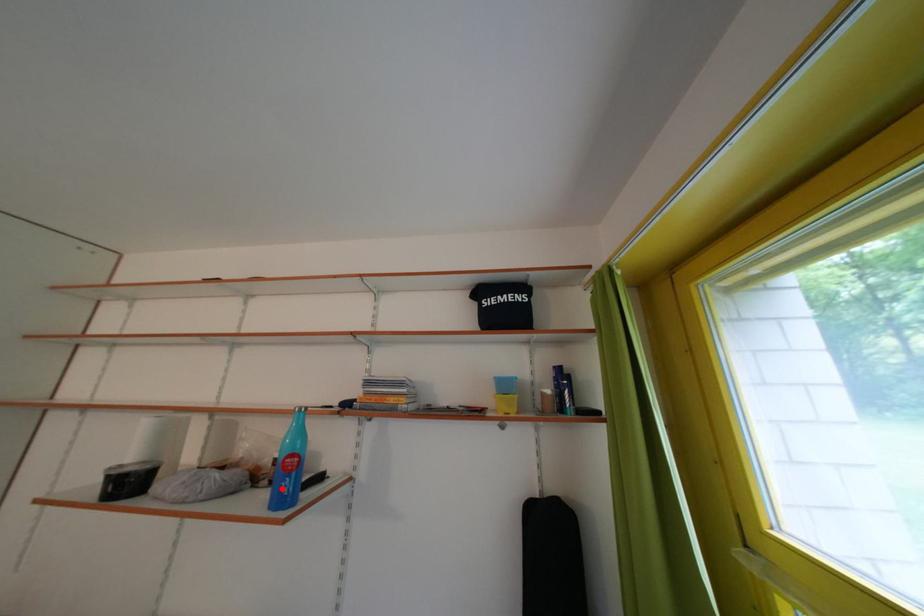
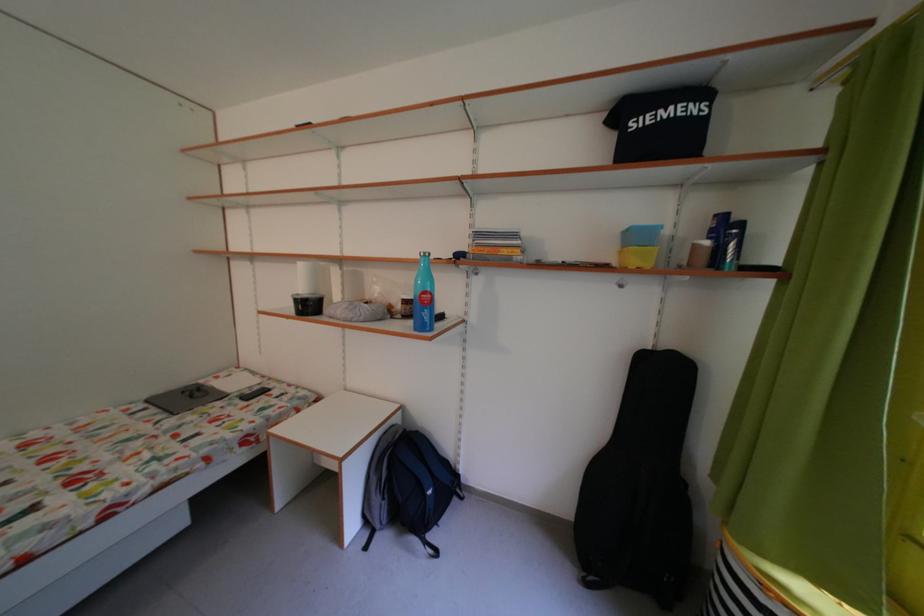
In the second image, find the point that corresponds to the highlighted location in the first image.

(416, 322)